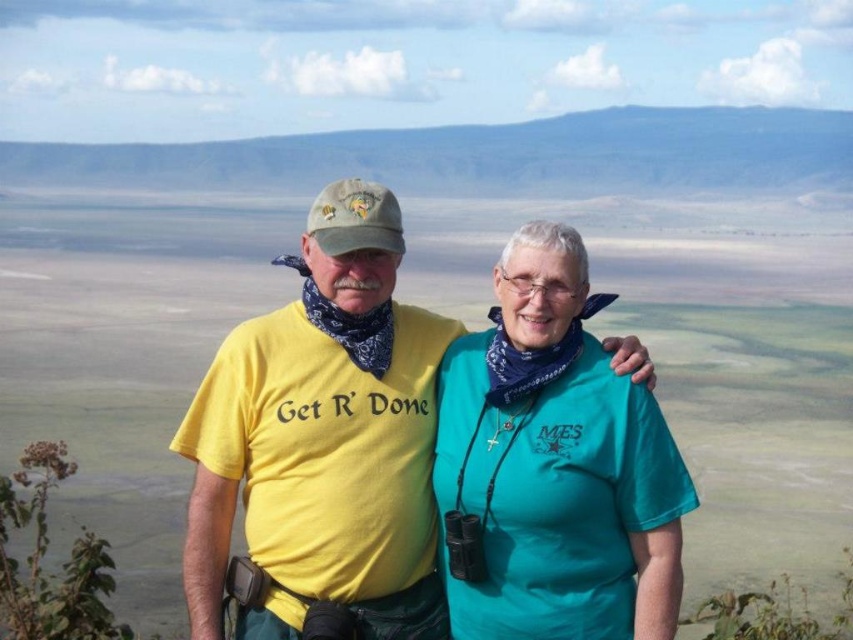
Question: Can you confirm if yellow matte t-shirt at center is smaller than teal fabric shirt at center?

Choices:
 (A) yes
 (B) no

Answer: (B)

Question: Which object is closer to the camera taking this photo?

Choices:
 (A) yellow matte t-shirt at center
 (B) teal fabric shirt at center

Answer: (A)

Question: Which object is closer to the camera taking this photo?

Choices:
 (A) teal fabric shirt at center
 (B) yellow matte t-shirt at center

Answer: (B)

Question: Is yellow matte t-shirt at center behind teal fabric shirt at center?

Choices:
 (A) yes
 (B) no

Answer: (B)

Question: Can you confirm if yellow matte t-shirt at center is bigger than teal fabric shirt at center?

Choices:
 (A) yes
 (B) no

Answer: (A)